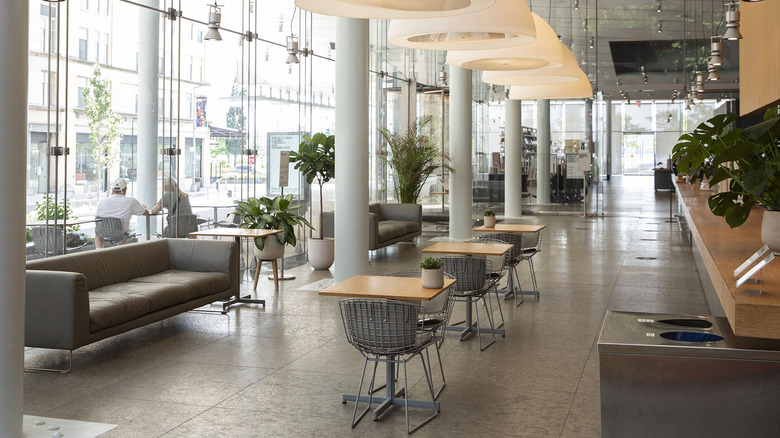
At what (x,y) coordinates should I click in order to perform the action: click on sofa cushions. Please return your answer as a coordinate pair (x, y). This screenshot has height=438, width=780. Looking at the image, I should click on (108, 313), (156, 299), (200, 280), (385, 238), (399, 228), (410, 228).